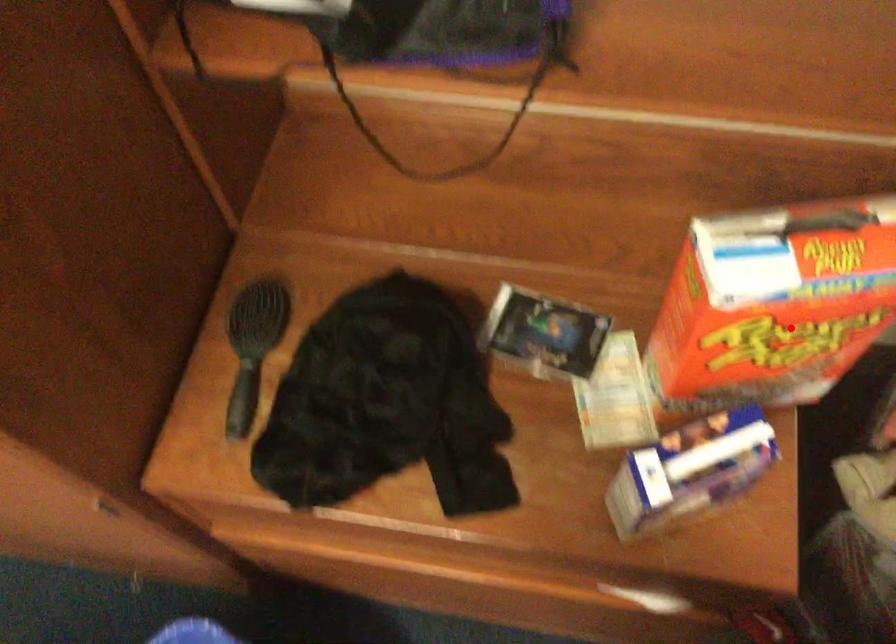
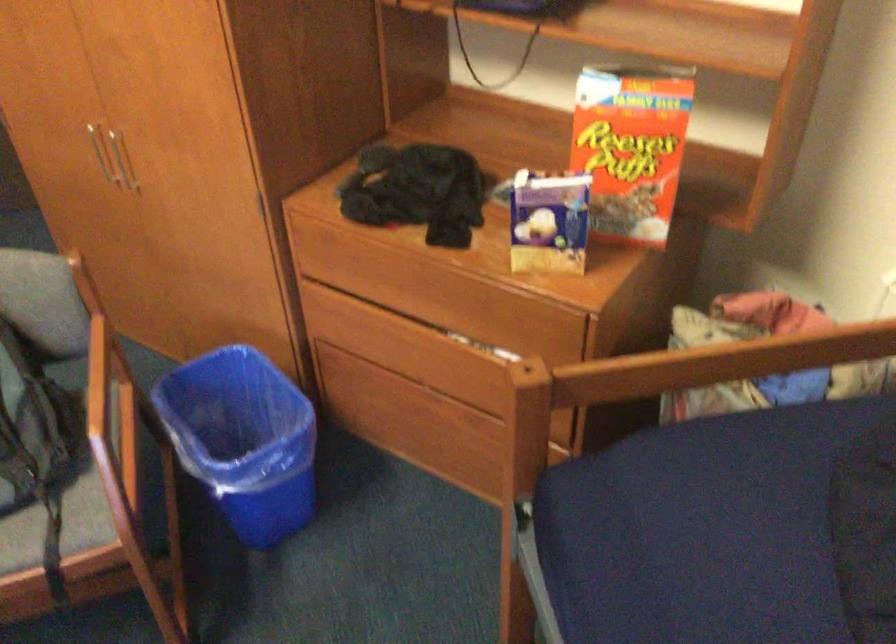
Question: A red point is marked in image1. In image2, is the corresponding 3D point closer to the camera or farther? Reply with the corresponding letter.

Choices:
 (A) The corresponding 3D point is closer.
 (B) The corresponding 3D point is farther.

Answer: (B)